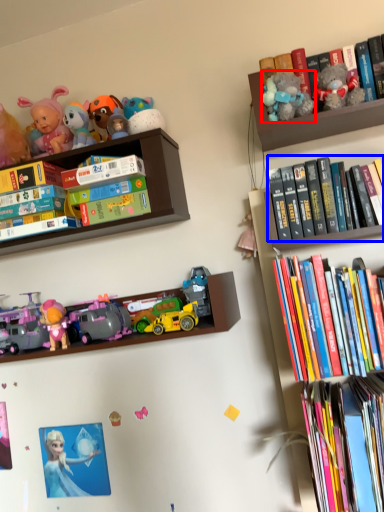
Question: Among these objects, which one is farthest to the camera, toy (highlighted by a red box) or book (highlighted by a blue box)?

Choices:
 (A) toy
 (B) book

Answer: (B)